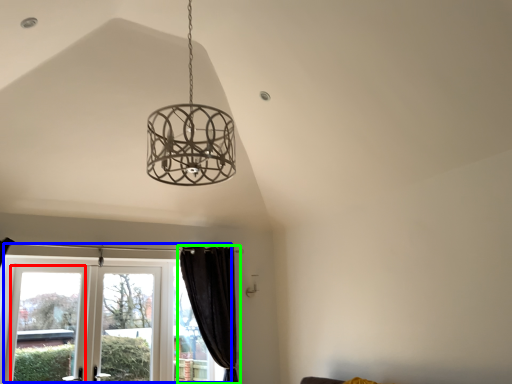
Question: Which object is positioned closest to window (highlighted by a red box)? Select from window (highlighted by a blue box) and curtain (highlighted by a green box).

Choices:
 (A) window
 (B) curtain

Answer: (A)